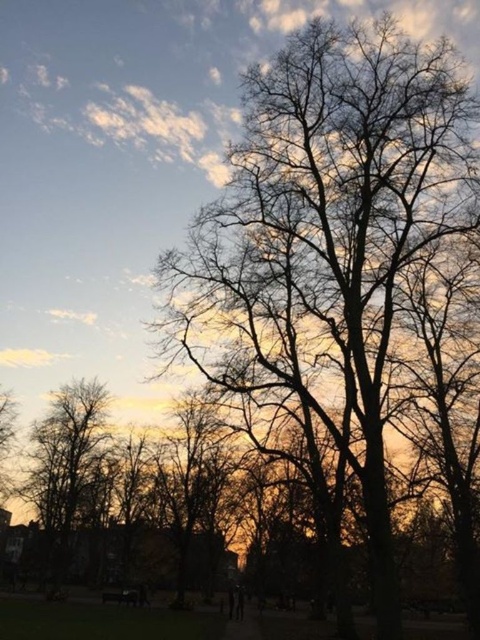
Question: Is silhouette bare tree at left positioned in front of wooden park bench at lower center?

Choices:
 (A) yes
 (B) no

Answer: (A)

Question: Which object is positioned farthest from the silhouette bare tree at left?

Choices:
 (A) wooden park bench at lower center
 (B) silhouette leafless tree at center

Answer: (B)

Question: Does silhouette bare tree at left appear on the right side of wooden park bench at lower center?

Choices:
 (A) no
 (B) yes

Answer: (A)

Question: Which point appears closest to the camera in this image?

Choices:
 (A) (94, 417)
 (B) (105, 595)
 (C) (323, 157)

Answer: (C)

Question: Which point is farther to the camera?

Choices:
 (A) wooden park bench at lower center
 (B) silhouette bare tree at left
 (C) silhouette leafless tree at center

Answer: (A)

Question: Is silhouette bare tree at left further to camera compared to wooden park bench at lower center?

Choices:
 (A) no
 (B) yes

Answer: (A)